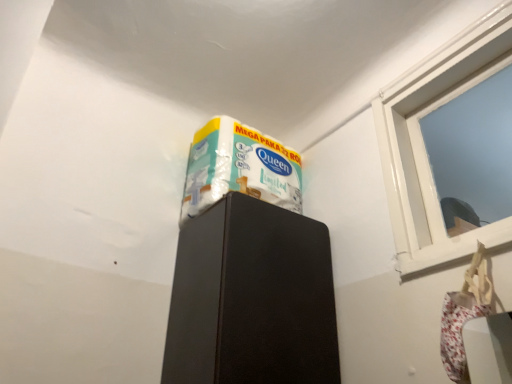
You are a GUI agent. You are given a task and a screenshot of the screen. Output one action in this format:
    pyautogui.click(x=<x>, y=<y>)
    Task: Click on the white glossy window at upper right
    This screenshot has width=512, height=384.
    Given the screenshot: What is the action you would take?
    pyautogui.click(x=424, y=145)

Measure the distance between white glossy wrapping paper at upper center and camera.

white glossy wrapping paper at upper center is 4.47 feet from camera.

The image size is (512, 384). I want to click on black matte cabinet at upper center, so [x=252, y=298].

Can you confirm if white glossy wrapping paper at upper center is taller than white glossy window at upper right?

In fact, white glossy wrapping paper at upper center may be shorter than white glossy window at upper right.

From the image's perspective, is white glossy wrapping paper at upper center located beneath white glossy window at upper right?

Indeed, from the image's perspective, white glossy wrapping paper at upper center is shown beneath white glossy window at upper right.

Who is smaller, white glossy wrapping paper at upper center or white glossy window at upper right?

Smaller between the two is white glossy window at upper right.

Considering the points (220, 132) and (482, 72), which point is in front, point (220, 132) or point (482, 72)?

The point (482, 72) is closer to the camera.

Is there a large distance between black matte cabinet at upper center and white glossy window at upper right?

No, black matte cabinet at upper center is in close proximity to white glossy window at upper right.

From the image's perspective, is black matte cabinet at upper center located above or below white glossy window at upper right?

black matte cabinet at upper center is below white glossy window at upper right.

Is black matte cabinet at upper center turned away from white glossy window at upper right?

No, white glossy window at upper right is not at the back of black matte cabinet at upper center.

From the image's perspective, which one is positioned lower, white glossy window at upper right or white glossy wrapping paper at upper center?

white glossy wrapping paper at upper center.

Which of these two, white glossy window at upper right or white glossy wrapping paper at upper center, stands shorter?

white glossy wrapping paper at upper center is shorter.

How different are the orientations of white glossy window at upper right and white glossy wrapping paper at upper center in degrees?

white glossy window at upper right and white glossy wrapping paper at upper center are facing 90 degrees away from each other.

Is white glossy window at upper right beside white glossy wrapping paper at upper center?

No, white glossy window at upper right is not touching white glossy wrapping paper at upper center.

How much distance is there between white glossy window at upper right and black matte cabinet at upper center?

A distance of 17.58 inches exists between white glossy window at upper right and black matte cabinet at upper center.

Considering the positions of objects white glossy window at upper right and black matte cabinet at upper center in the image provided, who is more to the left, white glossy window at upper right or black matte cabinet at upper center?

black matte cabinet at upper center.

Is white glossy window at upper right positioned before black matte cabinet at upper center?

Yes, white glossy window at upper right is closer to the camera.

Between white glossy window at upper right and black matte cabinet at upper center, which one has smaller width?

white glossy window at upper right.

From the picture: Which point is more forward, [226,168] or [322,257]?

The point [322,257] is more forward.

Is white glossy wrapping paper at upper center thinner than black matte cabinet at upper center?

Indeed, white glossy wrapping paper at upper center has a lesser width compared to black matte cabinet at upper center.

Which of these two, white glossy wrapping paper at upper center or black matte cabinet at upper center, is bigger?

black matte cabinet at upper center.

Is black matte cabinet at upper center aimed at white glossy wrapping paper at upper center?

No, black matte cabinet at upper center is not oriented towards white glossy wrapping paper at upper center.

How different are the orientations of black matte cabinet at upper center and white glossy wrapping paper at upper center in degrees?

1.27 degrees separate the facing orientations of black matte cabinet at upper center and white glossy wrapping paper at upper center.

Who is smaller, black matte cabinet at upper center or white glossy wrapping paper at upper center?

white glossy wrapping paper at upper center.

In terms of width, does black matte cabinet at upper center look wider or thinner when compared to white glossy wrapping paper at upper center?

In the image, black matte cabinet at upper center appears to be wider than white glossy wrapping paper at upper center.

Where is `wrapping paper lying below the white glossy window at upper right (from the image's perspective)`? The width and height of the screenshot is (512, 384). wrapping paper lying below the white glossy window at upper right (from the image's perspective) is located at coordinates (239, 168).

You are a GUI agent. You are given a task and a screenshot of the screen. Output one action in this format:
    pyautogui.click(x=<x>, y=<y>)
    Task: Click on the window above the black matte cabinet at upper center (from the image's perspective)
    
    Given the screenshot: What is the action you would take?
    pyautogui.click(x=424, y=145)

When comparing their distances from white glossy wrapping paper at upper center, does black matte cabinet at upper center or white glossy window at upper right seem closer?

Based on the image, black matte cabinet at upper center appears to be nearer to white glossy wrapping paper at upper center.

When comparing their distances from black matte cabinet at upper center, does white glossy window at upper right or white glossy wrapping paper at upper center seem closer?

white glossy wrapping paper at upper center is closer to black matte cabinet at upper center.

Based on their spatial positions, is white glossy wrapping paper at upper center or white glossy window at upper right closer to black matte cabinet at upper center?

white glossy wrapping paper at upper center.

Considering their positions, is white glossy window at upper right positioned closer to white glossy wrapping paper at upper center than black matte cabinet at upper center?

black matte cabinet at upper center is closer to white glossy wrapping paper at upper center.

Looking at the image, which one is located further to white glossy window at upper right, black matte cabinet at upper center or white glossy wrapping paper at upper center?

white glossy wrapping paper at upper center lies further to white glossy window at upper right than the other object.

Considering their positions, is white glossy wrapping paper at upper center positioned closer to white glossy window at upper right than black matte cabinet at upper center?

black matte cabinet at upper center lies closer to white glossy window at upper right than the other object.

Locate an element on the screen. The width and height of the screenshot is (512, 384). furniture located between white glossy wrapping paper at upper center and white glossy window at upper right in the left-right direction is located at coordinates (252, 298).